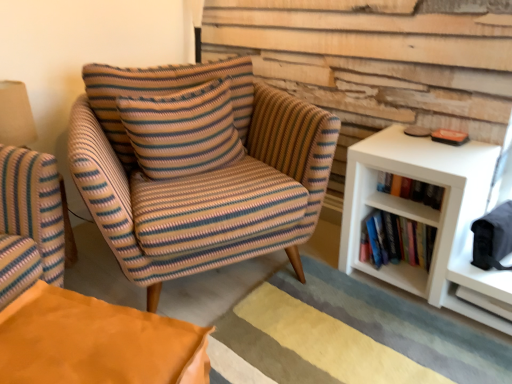
Question: From a real-world perspective, is hardcover books at right located higher than white matte shelf at right, which ranks as the second shelf in left-to-right order?

Choices:
 (A) yes
 (B) no

Answer: (A)

Question: From the image's perspective, would you say hardcover books at right is positioned over white matte shelf at right, which is counted as the first shelf, starting from the right?

Choices:
 (A) yes
 (B) no

Answer: (A)

Question: From a real-world perspective, is hardcover books at right positioned under white matte shelf at right, which is counted as the first shelf, starting from the right, based on gravity?

Choices:
 (A) yes
 (B) no

Answer: (B)

Question: Can you confirm if hardcover books at right is bigger than white matte shelf at right, which is counted as the first shelf, starting from the right?

Choices:
 (A) no
 (B) yes

Answer: (A)

Question: Considering the relative positions of hardcover books at right and white matte shelf at right, which is counted as the first shelf, starting from the right, in the image provided, is hardcover books at right to the right of white matte shelf at right, which is counted as the first shelf, starting from the right, from the viewer's perspective?

Choices:
 (A) yes
 (B) no

Answer: (B)

Question: Is hardcover books at right facing towards white matte shelf at right, which is counted as the first shelf, starting from the right?

Choices:
 (A) yes
 (B) no

Answer: (B)

Question: Does knitted fabric pillow at center come in front of white matte bookshelf at right, the second shelf when ordered from right to left?

Choices:
 (A) no
 (B) yes

Answer: (B)

Question: From the image's perspective, is knitted fabric pillow at center above white matte bookshelf at right, the second shelf when ordered from right to left?

Choices:
 (A) yes
 (B) no

Answer: (A)

Question: Can we say knitted fabric pillow at center lies outside white matte bookshelf at right, the second shelf when ordered from right to left?

Choices:
 (A) no
 (B) yes

Answer: (B)

Question: Is knitted fabric pillow at center shorter than white matte bookshelf at right, arranged as the 1th shelf when viewed from the left?

Choices:
 (A) yes
 (B) no

Answer: (B)

Question: Is white matte bookshelf at right, arranged as the 1th shelf when viewed from the left, at the back of knitted fabric pillow at center?

Choices:
 (A) no
 (B) yes

Answer: (A)

Question: Is knitted fabric pillow at center to the left of white matte bookshelf at right, arranged as the 1th shelf when viewed from the left, from the viewer's perspective?

Choices:
 (A) no
 (B) yes

Answer: (B)

Question: Is hardcover books at right wider than white matte bookshelf at right, the second shelf when ordered from right to left?

Choices:
 (A) yes
 (B) no

Answer: (B)